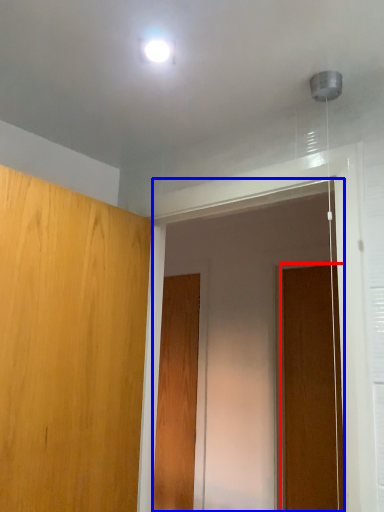
Question: Which object is further to the camera taking this photo, door (highlighted by a red box) or screen door (highlighted by a blue box)?

Choices:
 (A) door
 (B) screen door

Answer: (A)